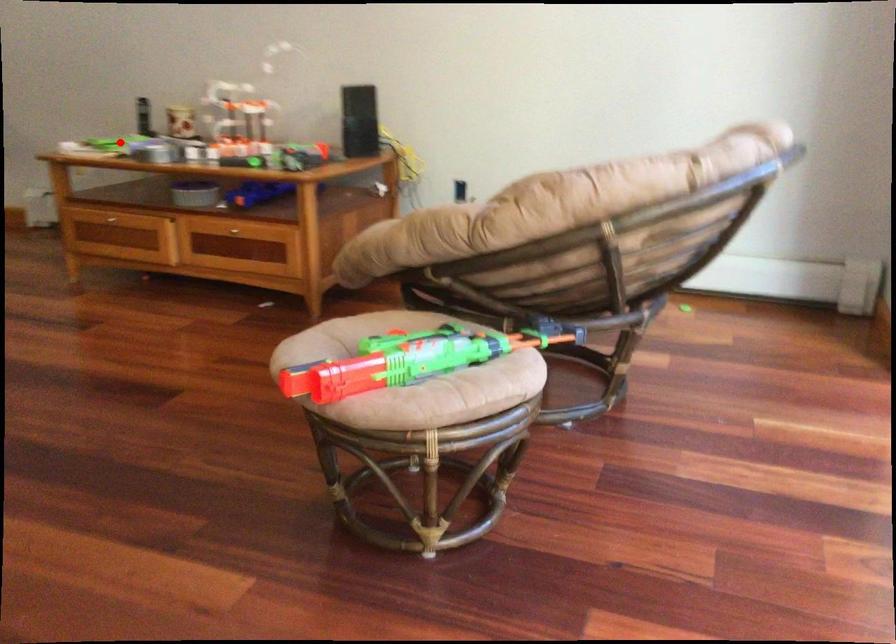
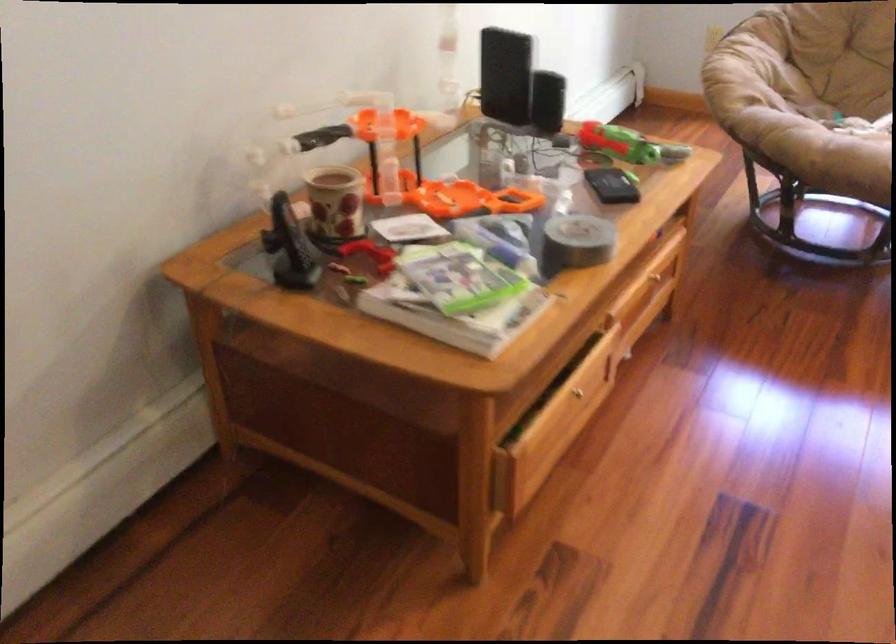
Question: I am providing you with two images of the same scene from different viewpoints. In image1, a red point is highlighted. Considering the same 3D point in image2, which of the following is correct?

Choices:
 (A) It is closer
 (B) It is farther

Answer: (A)